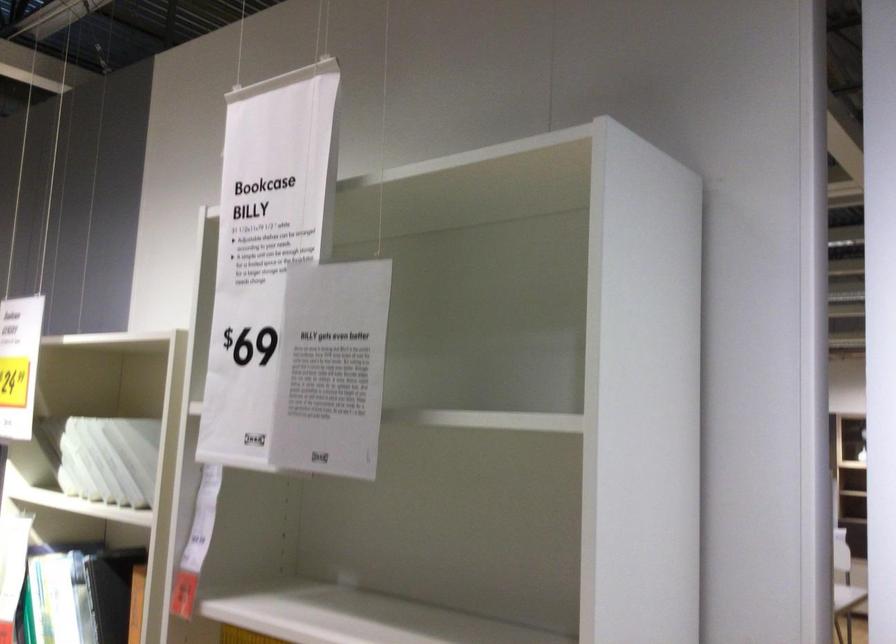
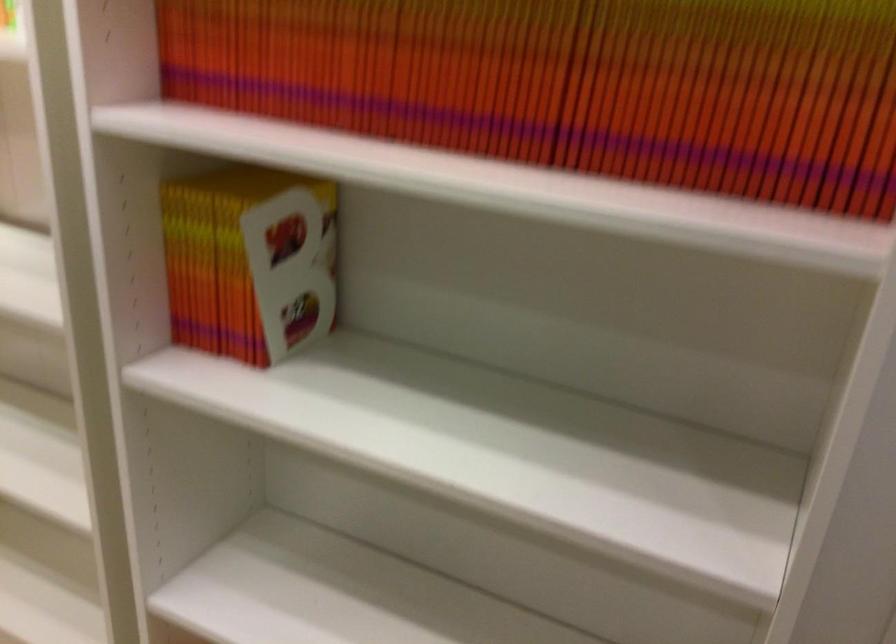
Question: The first image is from the beginning of the video and the second image is from the end. How did the camera likely rotate when shooting the video?

Choices:
 (A) Left
 (B) Right
 (C) Up
 (D) Down

Answer: (D)